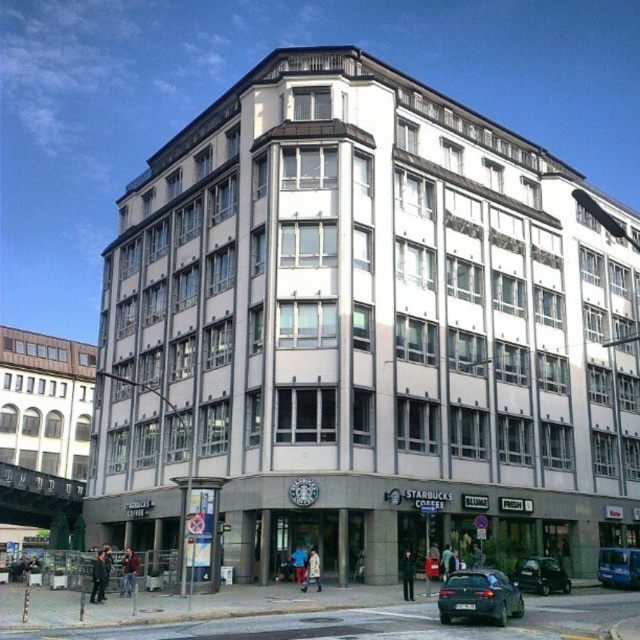
Based on the photo, you are a pedestrian standing on the sidewalk in front of the Starbucks Coffee shop. You see a shiny black car at center and a blue metallic van at center. Which vehicle is closer to you?

The shiny black car at center is closer to you than the blue metallic van at center.

You are a delivery person trying to park your van next to the shiny black sedan at center and the shiny black car at center. Can you determine which vehicle you should park next to if you need more space?

The shiny black sedan at center might be wider than shiny black car at center, so you should park next to the shiny black car at center to have more space available.